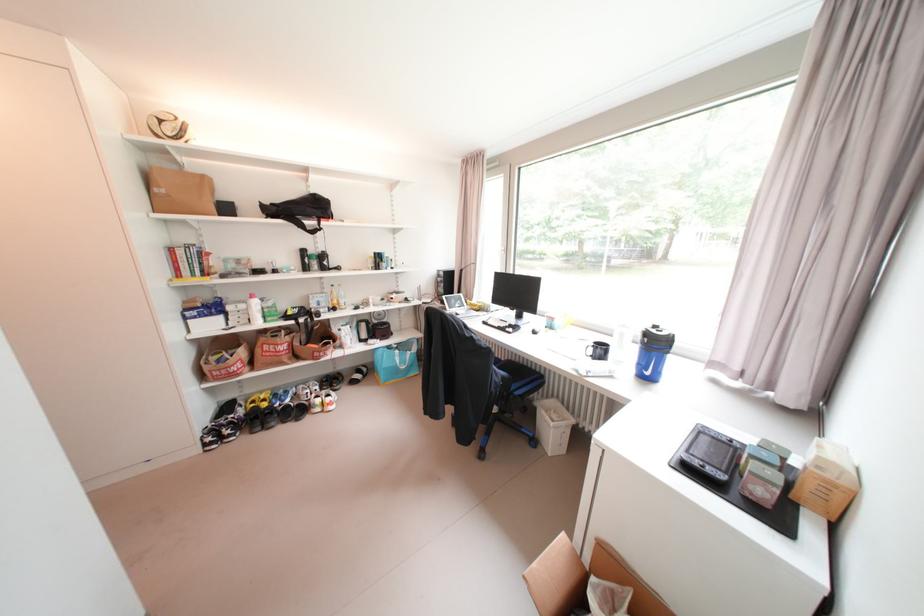
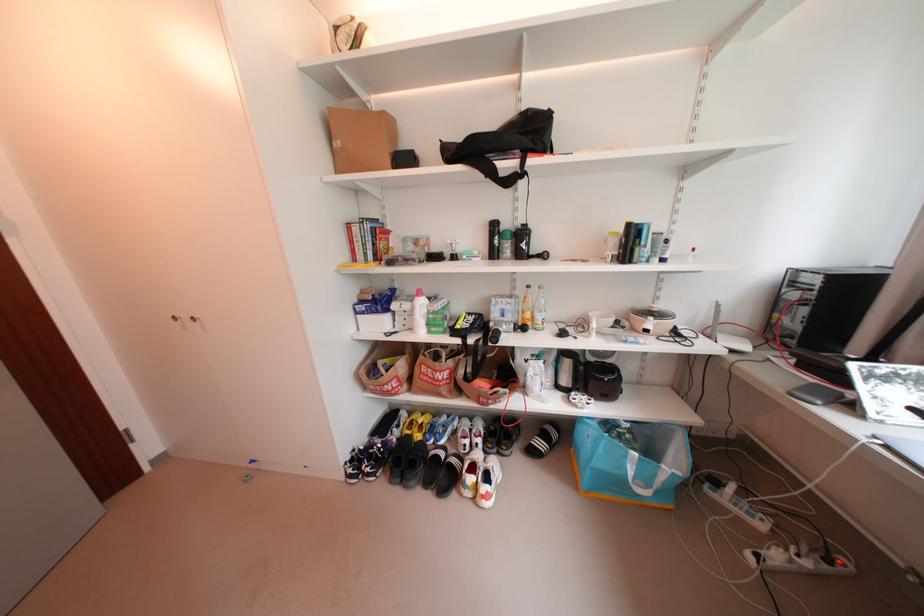
In the second image, find the point that corresponds to (368,371) in the first image.

(553, 437)